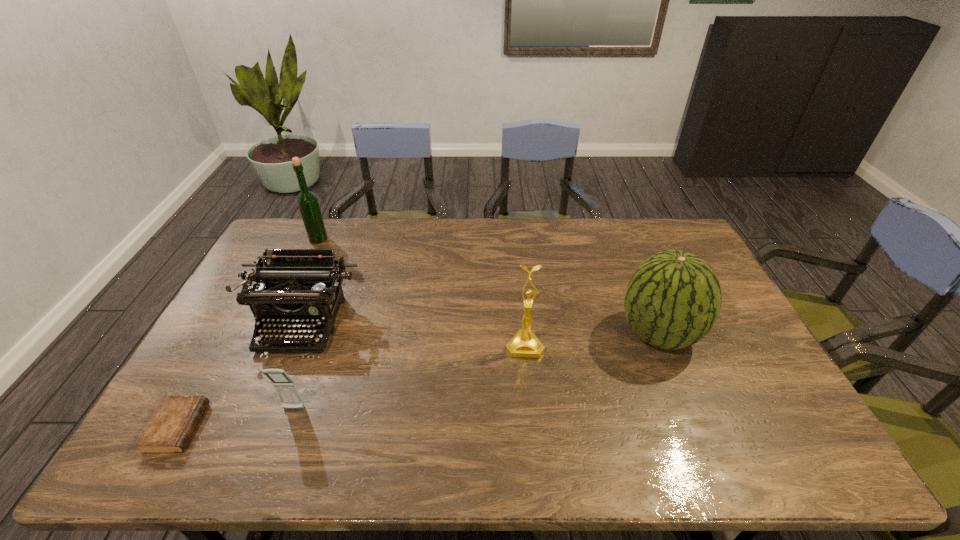
At what (x,y) coordinates should I click in order to perform the action: click on free space located on the front-facing side of the cellular telephone. Please return your answer as a coordinate pair (x, y). The image size is (960, 540). Looking at the image, I should click on (283, 439).

You are a GUI agent. You are given a task and a screenshot of the screen. Output one action in this format:
    pyautogui.click(x=<x>, y=<y>)
    Task: Click on the free space located on the spine side of the diary
    This screenshot has height=540, width=960.
    Given the screenshot: What is the action you would take?
    pyautogui.click(x=352, y=428)

At what (x,y) coordinates should I click in order to perform the action: click on object that is at the far edge. Please return your answer as a coordinate pair (x, y). The image size is (960, 540). Looking at the image, I should click on (307, 201).

This screenshot has height=540, width=960. I want to click on object that is at the near edge, so click(171, 426).

I want to click on liquor at the left edge, so click(x=307, y=201).

Image resolution: width=960 pixels, height=540 pixels. Identify the location of typewriter located at the left edge. (300, 287).

I want to click on diary present at the left edge, so click(x=171, y=426).

The image size is (960, 540). Identify the location of object that is positioned at the right edge. (673, 299).

Find the location of a particular element. This screenshot has width=960, height=540. object that is at the far left corner is located at coordinates (307, 201).

Locate an element on the screen. The height and width of the screenshot is (540, 960). object at the near left corner is located at coordinates (171, 426).